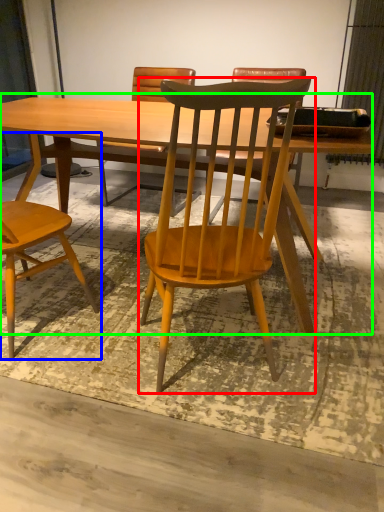
Question: Which object is the closest to the chair (highlighted by a red box)? Choose among these: chair (highlighted by a blue box) or table (highlighted by a green box).

Choices:
 (A) chair
 (B) table

Answer: (B)